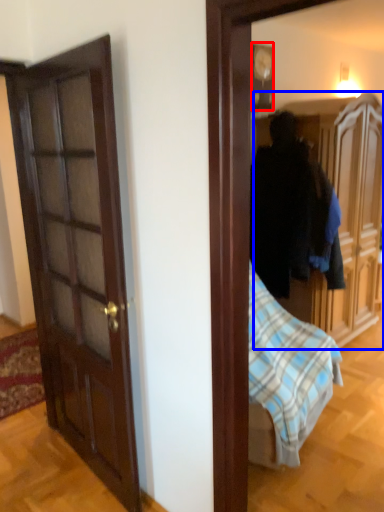
Question: Which point is closer to the camera, picture frame (highlighted by a red box) or cabinetry (highlighted by a blue box)?

Choices:
 (A) picture frame
 (B) cabinetry

Answer: (B)